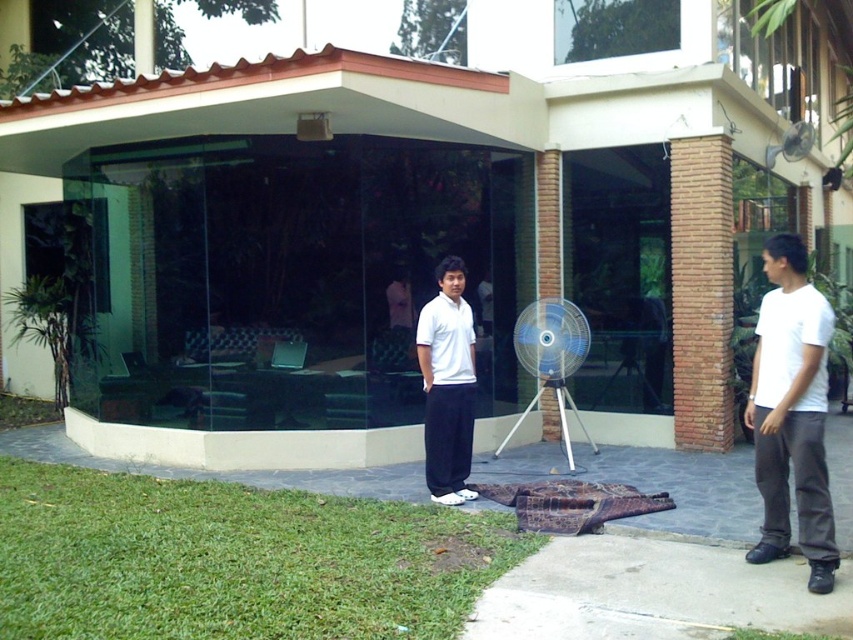
Question: Can you confirm if white matte shirt at center is positioned above white plastic fan at center?

Choices:
 (A) no
 (B) yes

Answer: (B)

Question: Which is farther from the metallic silver fan at upper right?

Choices:
 (A) white matte shirt at right
 (B) white matte shirt at center
 (C) white plastic fan at center

Answer: (A)

Question: Does white matte shirt at center have a greater width compared to white plastic fan at center?

Choices:
 (A) yes
 (B) no

Answer: (B)

Question: Can you confirm if white matte shirt at right is wider than white matte shirt at center?

Choices:
 (A) no
 (B) yes

Answer: (A)

Question: Which object is the farthest from the metallic silver fan at upper right?

Choices:
 (A) white plastic fan at center
 (B) white matte shirt at right
 (C) white matte shirt at center

Answer: (B)

Question: Among these points, which one is farthest from the camera?

Choices:
 (A) (809, 125)
 (B) (781, 557)
 (C) (447, 394)

Answer: (A)